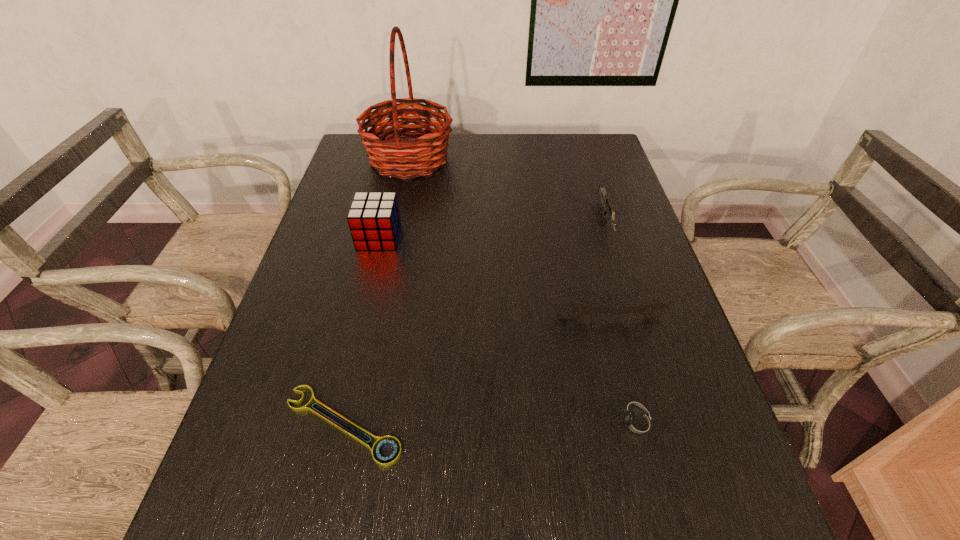
The width and height of the screenshot is (960, 540). Find the location of `wrench that is at the left edge`. wrench that is at the left edge is located at coordinates (381, 442).

Identify the location of gun at the right edge. The width and height of the screenshot is (960, 540). (606, 202).

At what (x,y) coordinates should I click in order to perform the action: click on wrench that is positioned at the right edge. Please return your answer as a coordinate pair (x, y). This screenshot has width=960, height=540. Looking at the image, I should click on (646, 310).

This screenshot has height=540, width=960. In order to click on watch that is at the right edge in this screenshot , I will do `click(636, 423)`.

In order to click on object located at the far left corner in this screenshot , I will do `click(428, 151)`.

The width and height of the screenshot is (960, 540). Find the location of `vacant space at the far edge of the desktop`. vacant space at the far edge of the desktop is located at coordinates (493, 164).

Find the location of a particular element. This screenshot has height=540, width=960. blank space at the left edge of the desktop is located at coordinates (290, 334).

Locate an element on the screen. This screenshot has height=540, width=960. vacant space at the right edge is located at coordinates (623, 196).

Image resolution: width=960 pixels, height=540 pixels. I want to click on free space at the far right corner of the desktop, so click(597, 171).

Locate an element on the screen. blank region between the nearer wrench and the farthest object is located at coordinates (376, 292).